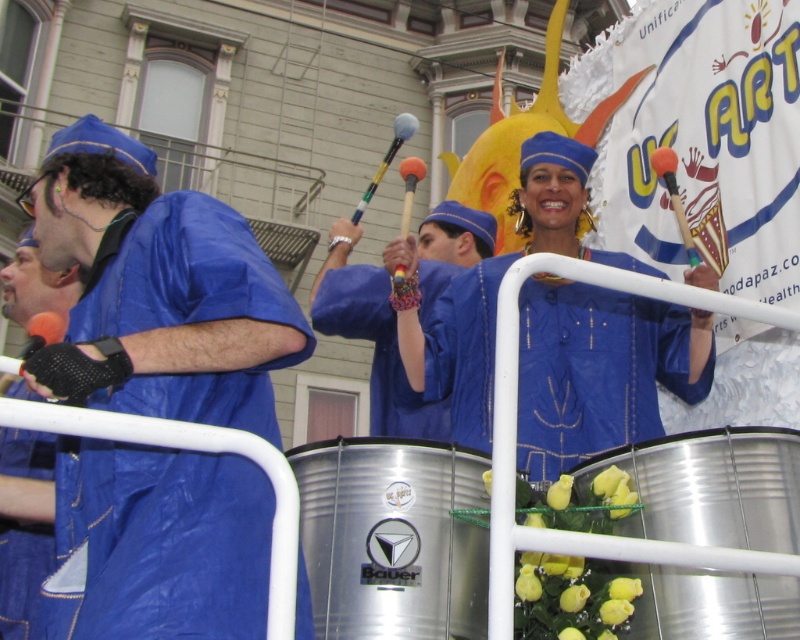
Question: Is silver metallic drum at lower right further to camera compared to blue fabric glove at left?

Choices:
 (A) no
 (B) yes

Answer: (A)

Question: Can you confirm if blue shiny fabric at center is positioned to the left of silver metallic drum at lower right?

Choices:
 (A) yes
 (B) no

Answer: (A)

Question: Among these points, which one is nearest to the camera?

Choices:
 (A) (420, 378)
 (B) (648, 477)
 (C) (50, 548)

Answer: (B)

Question: From the image, what is the correct spatial relationship of blue shiny fabric at center in relation to silver metallic drum at center?

Choices:
 (A) left
 (B) right

Answer: (B)

Question: Which of the following is the farthest from the observer?

Choices:
 (A) silver metallic drum at center
 (B) blue fabric glove at left
 (C) blue shiny fabric at center

Answer: (B)

Question: Which point is farther from the camera taking this photo?

Choices:
 (A) (44, 285)
 (B) (184, 305)
 (C) (732, 609)

Answer: (A)